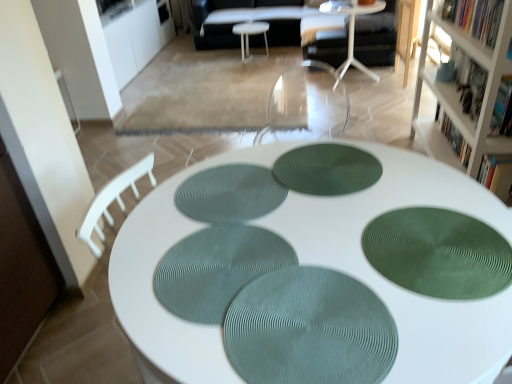
Identify the location of vacant area that lies between green textured placemat at center, marked as the 3th mat in a left-to-right arrangement, and green textured placemat at center, the 4th mat from the right. (292, 199).